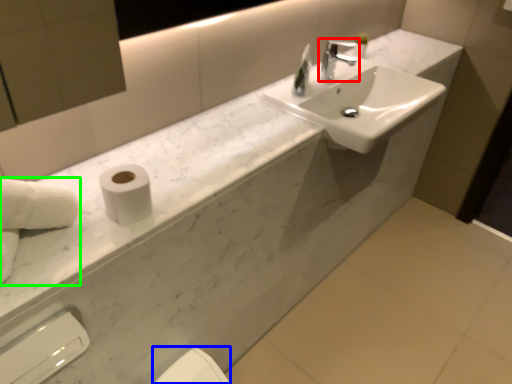
Question: Which is nearer to the tap (highlighted by a red box)? bidet (highlighted by a blue box) or hand towel (highlighted by a green box).

Choices:
 (A) bidet
 (B) hand towel

Answer: (A)